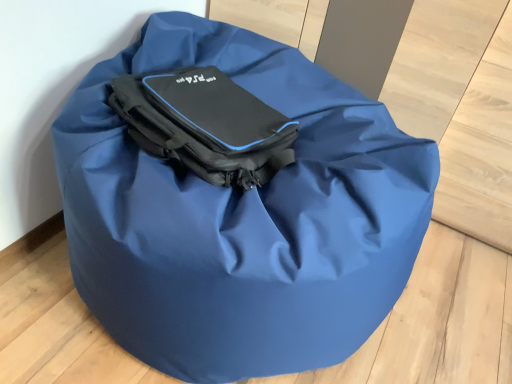
Question: From the image's perspective, is matte black bag at center above or below matte blue bag at center?

Choices:
 (A) above
 (B) below

Answer: (A)

Question: Is matte black bag at center bigger or smaller than matte blue bag at center?

Choices:
 (A) small
 (B) big

Answer: (A)

Question: Relative to matte blue bag at center, is matte black bag at center in front or behind?

Choices:
 (A) behind
 (B) front

Answer: (A)

Question: From a real-world perspective, is matte blue bag at center above or below matte black bag at center?

Choices:
 (A) below
 (B) above

Answer: (A)

Question: In terms of size, does matte blue bag at center appear bigger or smaller than matte black bag at center?

Choices:
 (A) big
 (B) small

Answer: (A)

Question: From the image's perspective, is matte blue bag at center above or below matte black bag at center?

Choices:
 (A) below
 (B) above

Answer: (A)

Question: From their relative heights in the image, would you say matte blue bag at center is taller or shorter than matte black bag at center?

Choices:
 (A) tall
 (B) short

Answer: (A)